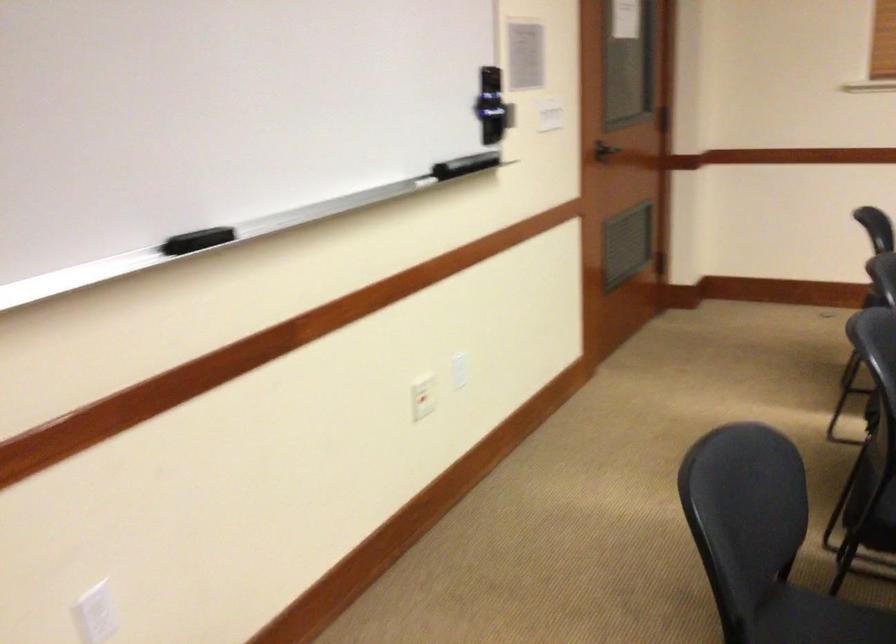
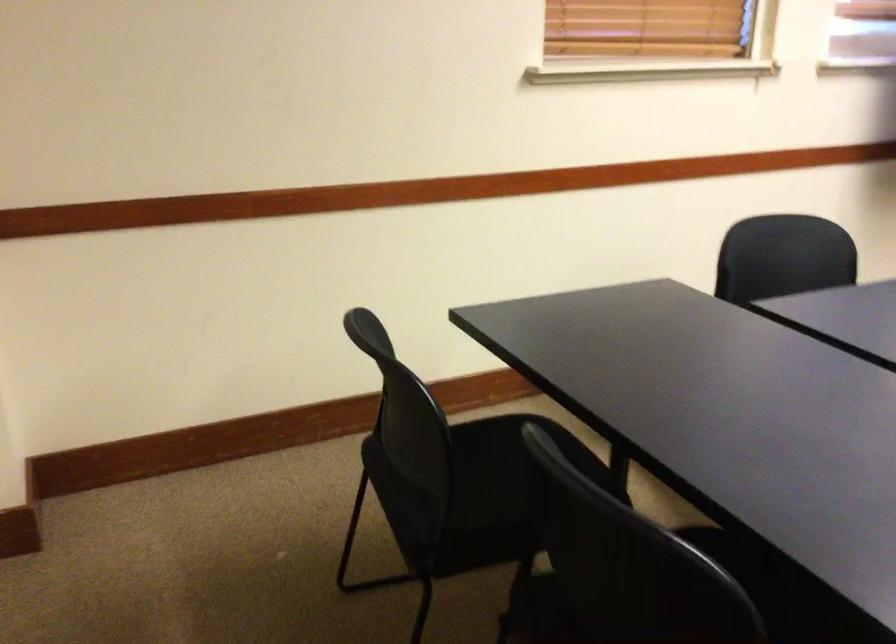
Question: In a continuous first-person perspective shot, in which direction is the camera moving?

Choices:
 (A) Left
 (B) Right
 (C) Forward
 (D) Backward

Answer: (D)